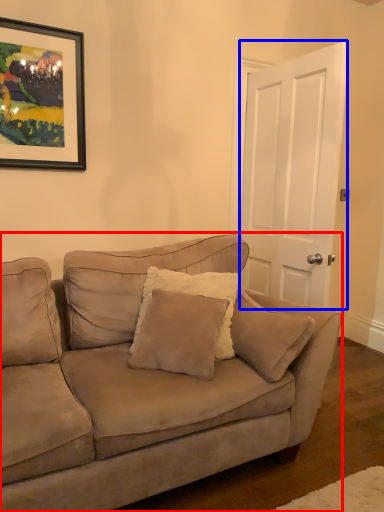
Question: Which point is closer to the camera, studio couch (highlighted by a red box) or door (highlighted by a blue box)?

Choices:
 (A) studio couch
 (B) door

Answer: (A)